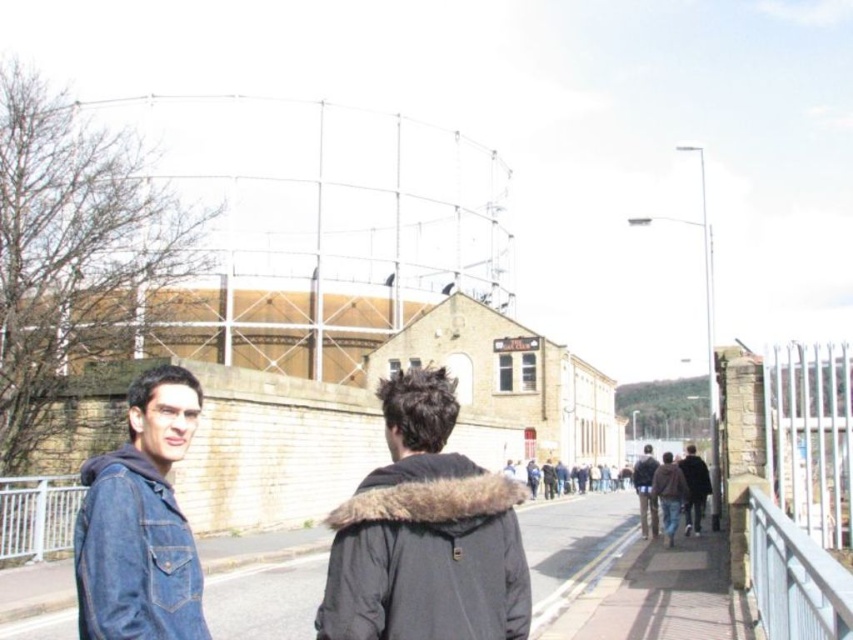
Question: Does smooth concrete pavement at center come behind dark brown leather jacket at right?

Choices:
 (A) yes
 (B) no

Answer: (B)

Question: Which of the following is the closest to the observer?

Choices:
 (A) (628, 522)
 (B) (641, 531)
 (C) (683, 470)
 (D) (366, 557)

Answer: (D)

Question: Is dark brown fur-lined jacket at center thinner than white metal fence at lower left?

Choices:
 (A) no
 (B) yes

Answer: (A)

Question: Which point is closer to the camera taking this photo?

Choices:
 (A) (672, 480)
 (B) (479, 588)

Answer: (B)

Question: Is dark brown fur-lined jacket at center smaller than dark brown fur coat at right?

Choices:
 (A) no
 (B) yes

Answer: (B)

Question: Which of the following is the farthest from the observer?

Choices:
 (A) (761, 556)
 (B) (402, 467)

Answer: (A)